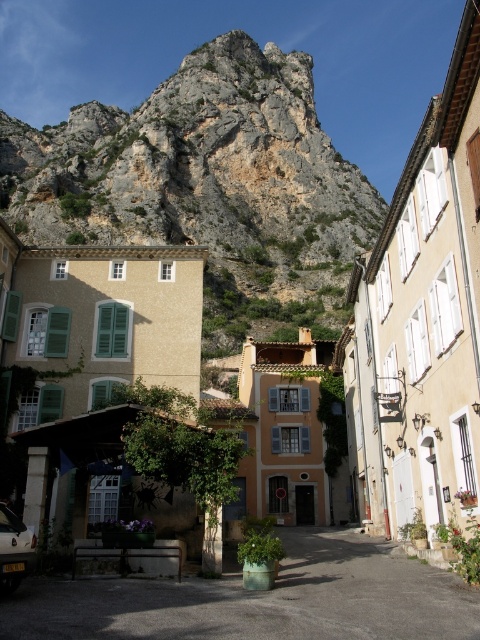
Is rocky cliff at upper center above green concrete planter at center?

Yes, rocky cliff at upper center is above green concrete planter at center.

How far apart are rocky cliff at upper center and green concrete planter at center?

The distance of rocky cliff at upper center from green concrete planter at center is 139.97 meters.

Is point (123, 147) farther from viewer compared to point (195, 614)?

Yes.

Locate an element on the screen. The image size is (480, 640). rocky cliff at upper center is located at coordinates (207, 188).